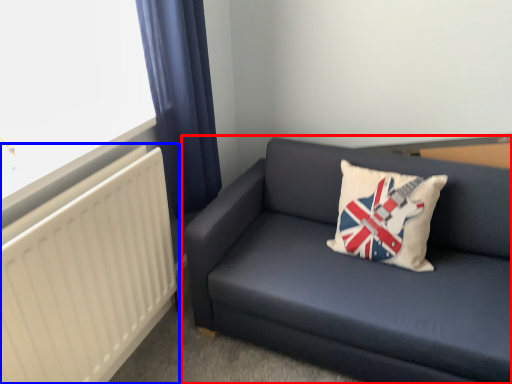
Question: Among these objects, which one is farthest to the camera, studio couch (highlighted by a red box) or radiator (highlighted by a blue box)?

Choices:
 (A) studio couch
 (B) radiator

Answer: (A)